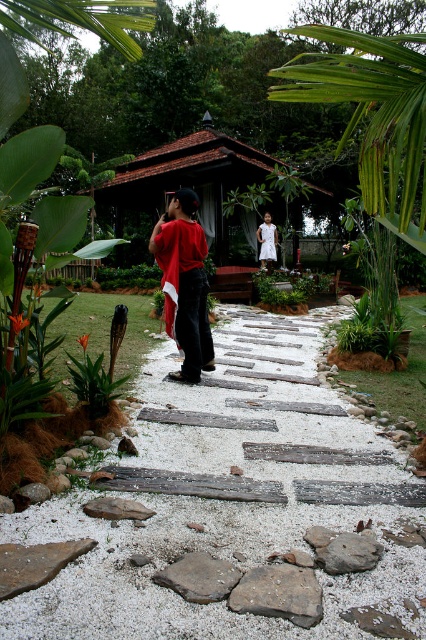
You are standing at the point with coordinates (233, 506) in the garden scene. What material do you see under your feet?

The point at (233, 506) has white gravel at center underneath it.

You are a gardener planning to water the green leafy bush at center and the brown wooden gazebo at center. Since you can only reach up to 2 meters, which object can you water without needing a ladder?

The green leafy bush at center is behind the brown wooden gazebo at center, so the brown wooden gazebo at center is closer to you. Since you can reach up to 2 meters, you can water both objects as their positions do not require a ladder.

You are a gardener who needs to place a 1.5 meter tall statue between the brown wooden gazebo at center and the green leafy bush at center. Which object should the statue be placed closer to so it doesn

The brown wooden gazebo at center is taller than the green leafy bush at center, so the statue should be placed closer to the green leafy bush at center to maintain visual balance between the two objects.